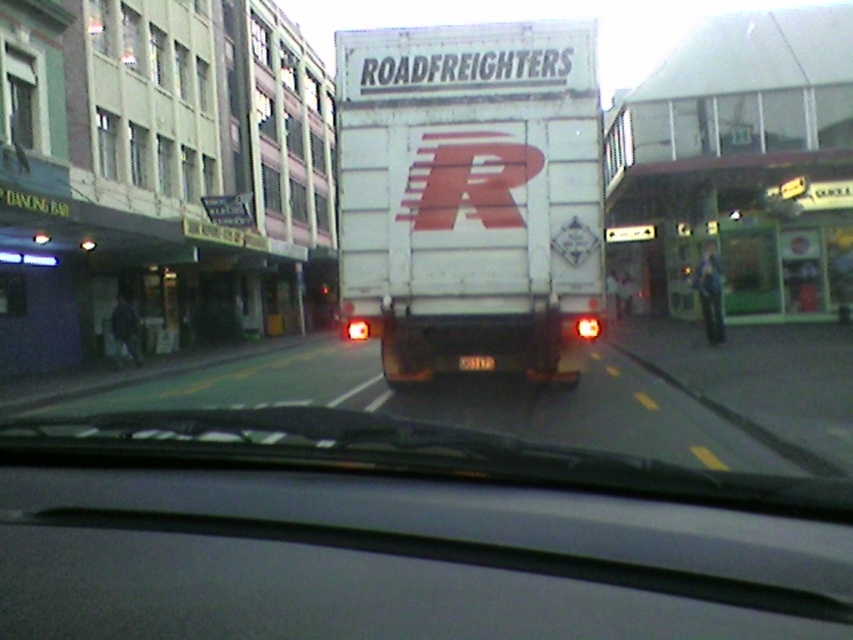
Does white matte trailer truck at center appear on the right side of black plastic license plate at rear?

Incorrect, white matte trailer truck at center is not on the right side of black plastic license plate at rear.

Is white matte trailer truck at center shorter than black plastic license plate at rear?

No, white matte trailer truck at center is not shorter than black plastic license plate at rear.

Is point (563, 205) positioned in front of point (474, 365)?

Yes, it is in front of point (474, 365).

Find the location of `white matte trailer truck at center`. white matte trailer truck at center is located at coordinates (471, 195).

Can you confirm if matte black dashboard at center is wider than black plastic license plate at rear?

Yes.

Can you confirm if matte black dashboard at center is bigger than black plastic license plate at rear?

Yes.

This screenshot has height=640, width=853. Describe the element at coordinates (397, 536) in the screenshot. I see `matte black dashboard at center` at that location.

This screenshot has height=640, width=853. Identify the location of matte black dashboard at center. (397, 536).

Does point (780, 497) lie behind point (450, 339)?

No.

Who is shorter, matte black dashboard at center or white matte trailer truck at center?

matte black dashboard at center is shorter.

This screenshot has width=853, height=640. Describe the element at coordinates (397, 536) in the screenshot. I see `matte black dashboard at center` at that location.

Where is `matte black dashboard at center`? Image resolution: width=853 pixels, height=640 pixels. matte black dashboard at center is located at coordinates (397, 536).